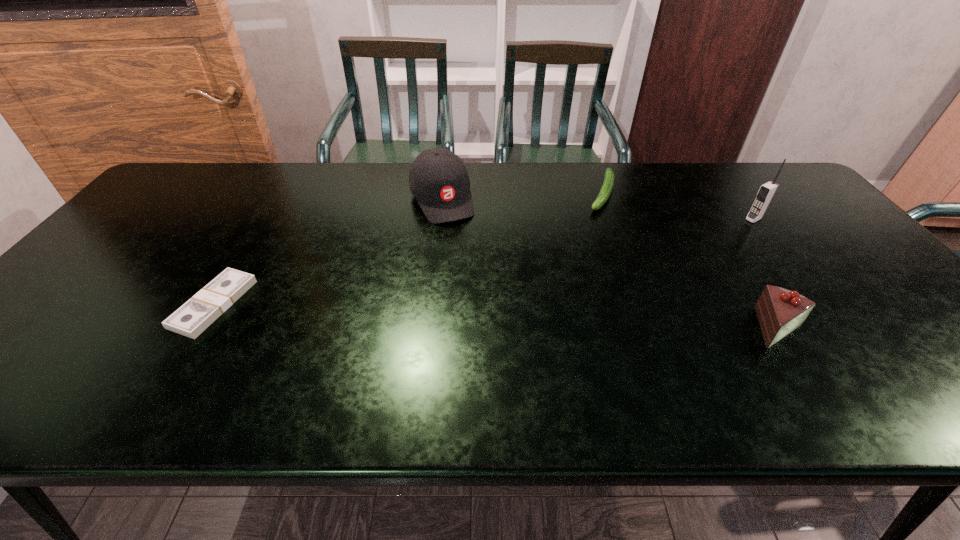
The image size is (960, 540). In order to click on the third closest object to the cellular telephone in this screenshot , I will do `click(438, 179)`.

Where is `the second closest object to the shortest object`? This screenshot has height=540, width=960. the second closest object to the shortest object is located at coordinates (606, 189).